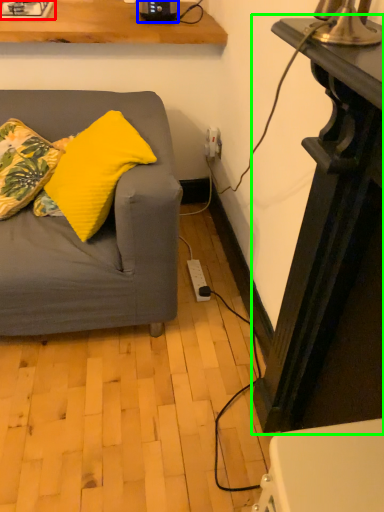
Question: Based on their relative distances, which object is nearer to gas stove (highlighted by a red box)? Choose from appliance (highlighted by a blue box) and table (highlighted by a green box).

Choices:
 (A) appliance
 (B) table

Answer: (A)